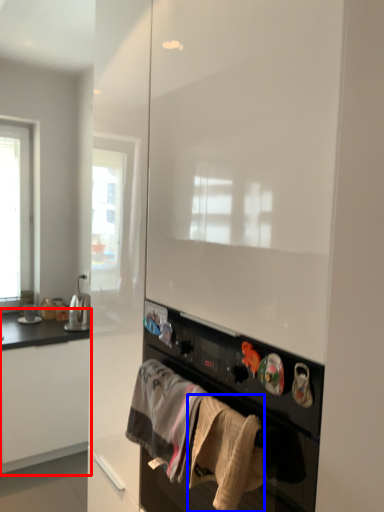
Question: Which object appears closest to the camera in this image, cabinetry (highlighted by a red box) or clothing (highlighted by a blue box)?

Choices:
 (A) cabinetry
 (B) clothing

Answer: (B)